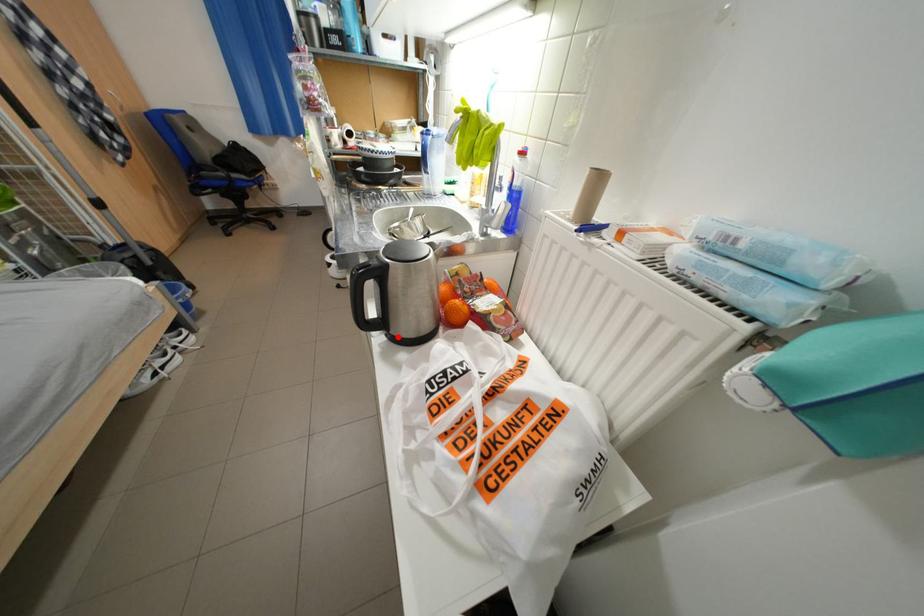
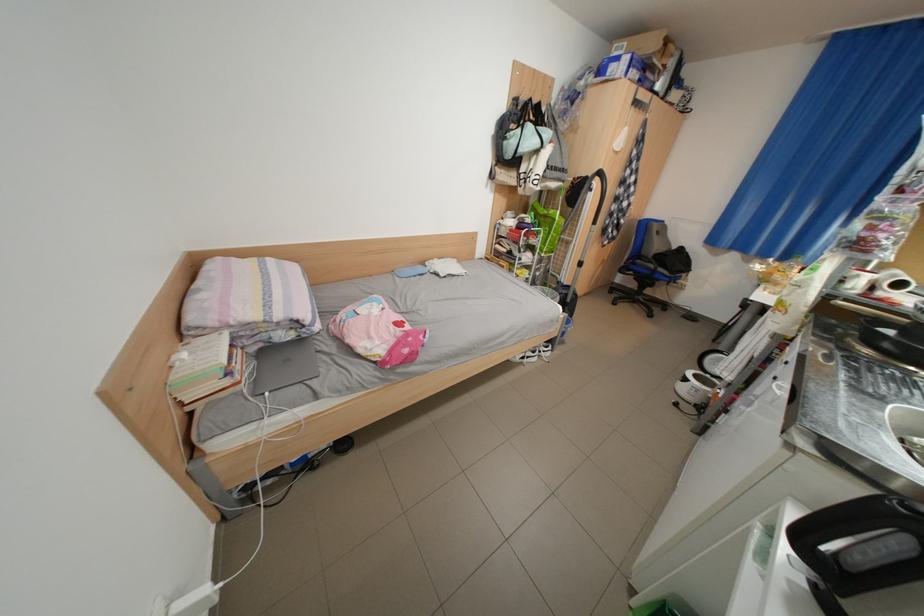
Question: A red point is marked in image1. In image2, is the corresponding 3D point closer to the camera or farther? Reply with the corresponding letter.

Choices:
 (A) The corresponding 3D point is closer.
 (B) The corresponding 3D point is farther.

Answer: (A)